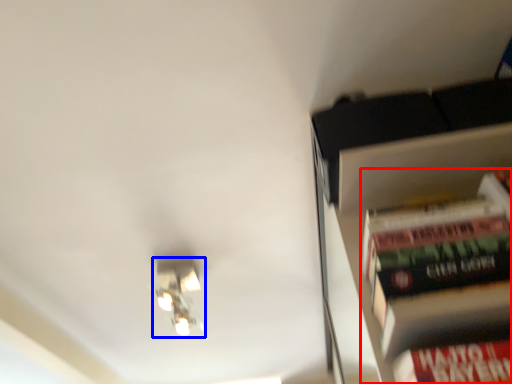
Question: Which of the following is the closest to the observer, book (highlighted by a red box) or light fixture (highlighted by a blue box)?

Choices:
 (A) book
 (B) light fixture

Answer: (A)